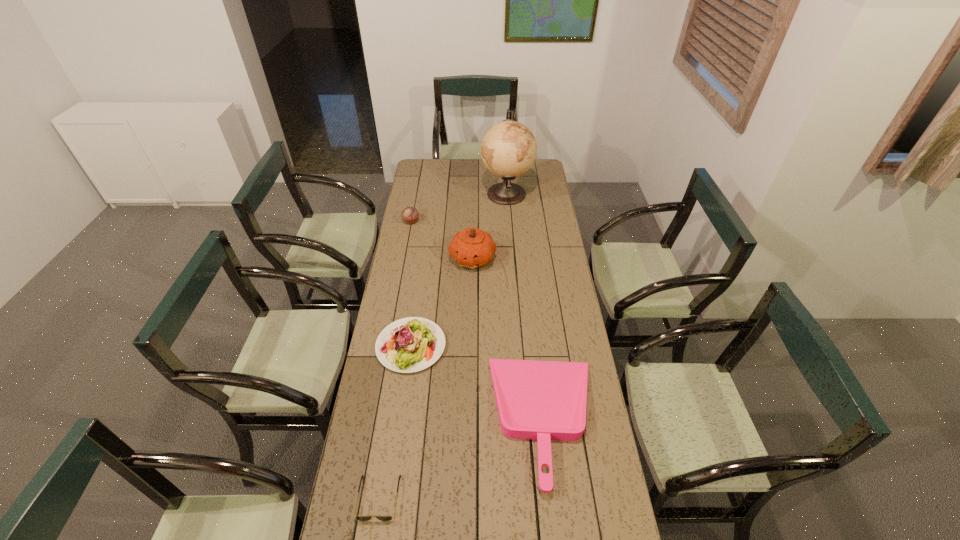
Locate an element on the screen. salad plate present at the left edge is located at coordinates (411, 344).

Locate an element on the screen. This screenshot has width=960, height=540. sunglasses that is at the left edge is located at coordinates coord(361,518).

You are a GUI agent. You are given a task and a screenshot of the screen. Output one action in this format:
    pyautogui.click(x=<x>, y=<y>)
    Task: Click on the globe that is at the right edge
    The height and width of the screenshot is (540, 960).
    Given the screenshot: What is the action you would take?
    pyautogui.click(x=508, y=149)

You are a GUI agent. You are given a task and a screenshot of the screen. Output one action in this format:
    pyautogui.click(x=<x>, y=<y>)
    Task: Click on the dustpan positioned at the right edge
    The height and width of the screenshot is (540, 960).
    Given the screenshot: What is the action you would take?
    pyautogui.click(x=542, y=400)

Find the location of a particular element. This screenshot has height=540, width=960. object at the far right corner is located at coordinates (508, 149).

The image size is (960, 540). What are the coordinates of `free space at the left edge of the desktop` in the screenshot? It's located at (423, 222).

In the image, there is a desktop. Identify the location of vacant space at the right edge. This screenshot has height=540, width=960. (542, 274).

What are the coordinates of `free spot at the far right corner of the desktop` in the screenshot? It's located at (529, 177).

Find the location of `vacant space in between the farthest object and the second tallest object`. vacant space in between the farthest object and the second tallest object is located at coordinates (490, 226).

The height and width of the screenshot is (540, 960). I want to click on free space between the salad plate and the sunglasses, so click(395, 422).